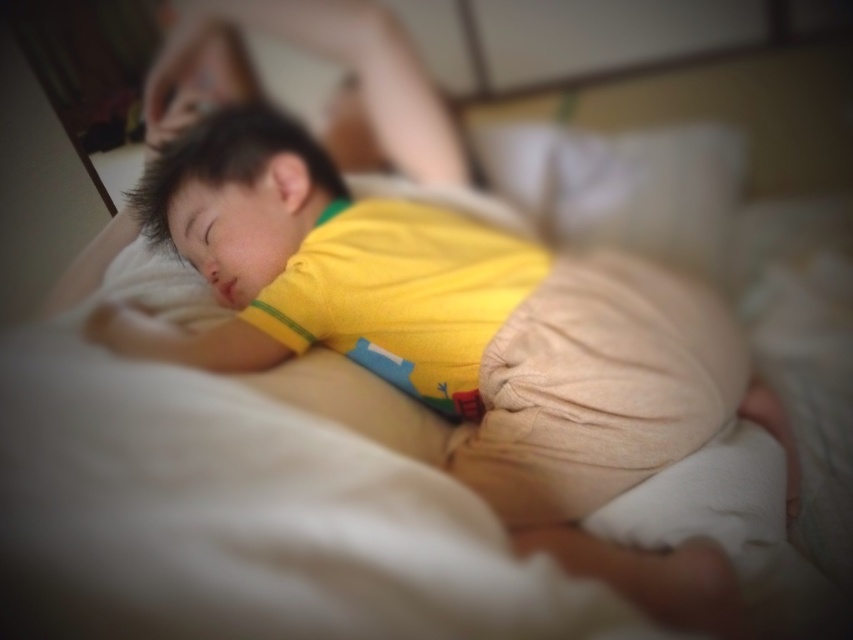
Question: Which of the following is the farthest from the observer?

Choices:
 (A) yellow cotton shirt at center
 (B) beige soft pillow at upper center

Answer: (B)

Question: Is the position of yellow cotton shirt at center less distant than that of beige soft pillow at upper center?

Choices:
 (A) no
 (B) yes

Answer: (B)

Question: Which point is farther to the camera?

Choices:
 (A) yellow cotton shirt at center
 (B) beige soft pillow at upper center

Answer: (B)

Question: Observing the image, what is the correct spatial positioning of yellow cotton shirt at center in reference to beige soft pillow at upper center?

Choices:
 (A) above
 (B) below

Answer: (B)

Question: Among these points, which one is nearest to the camera?

Choices:
 (A) (706, 227)
 (B) (352, 289)

Answer: (B)

Question: Is yellow cotton shirt at center positioned at the back of beige soft pillow at upper center?

Choices:
 (A) yes
 (B) no

Answer: (B)